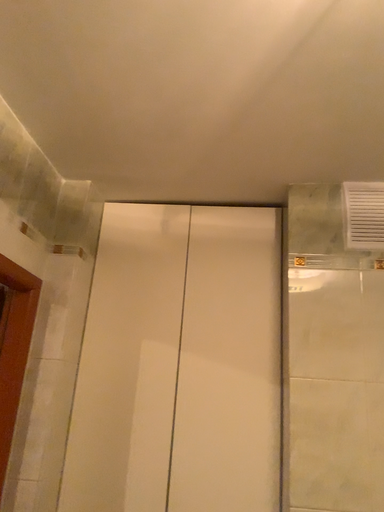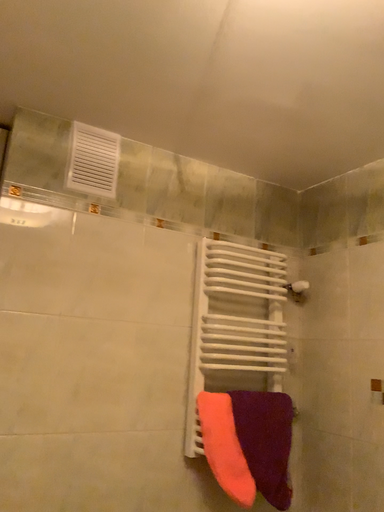
Question: Which way did the camera rotate in the video?

Choices:
 (A) rotated right
 (B) rotated left

Answer: (A)